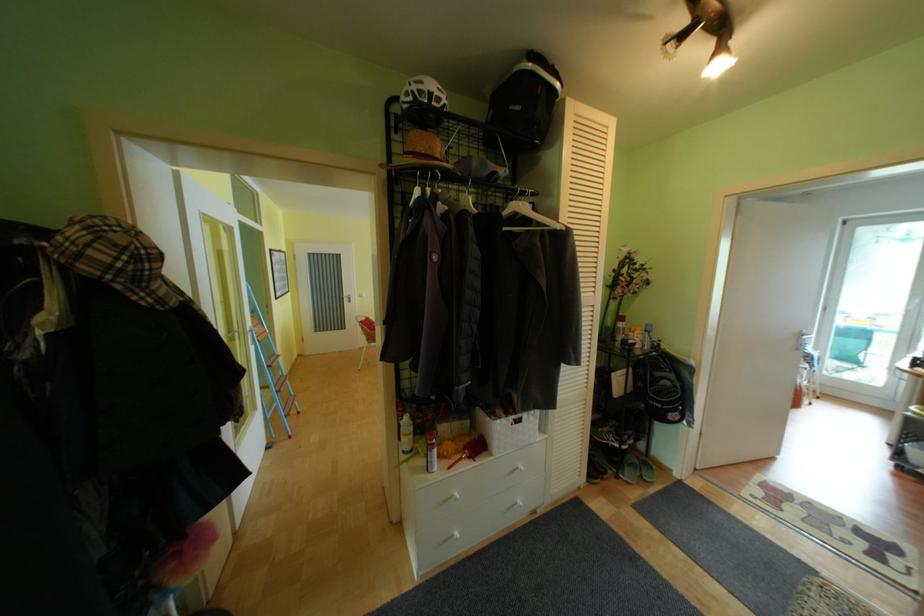
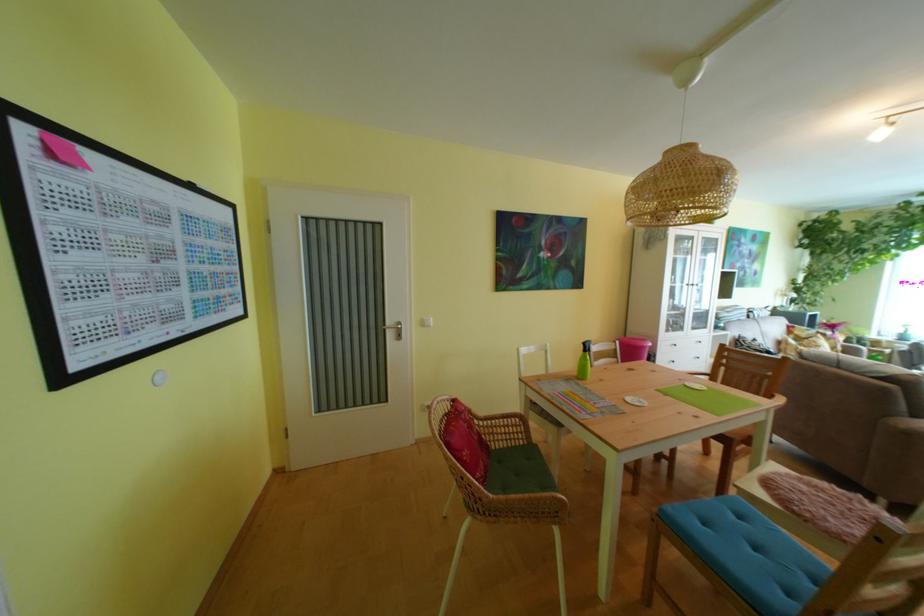
In a continuous first-person perspective shot, in which direction is the camera moving?

The cameraman moved toward left, forward.